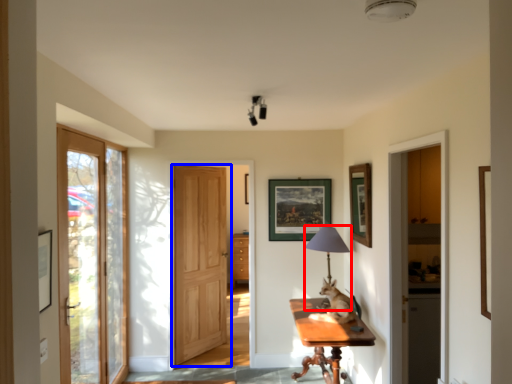
Question: Which of the following is the closest to the observer, table lamp (highlighted by a red box) or door (highlighted by a blue box)?

Choices:
 (A) table lamp
 (B) door

Answer: (A)